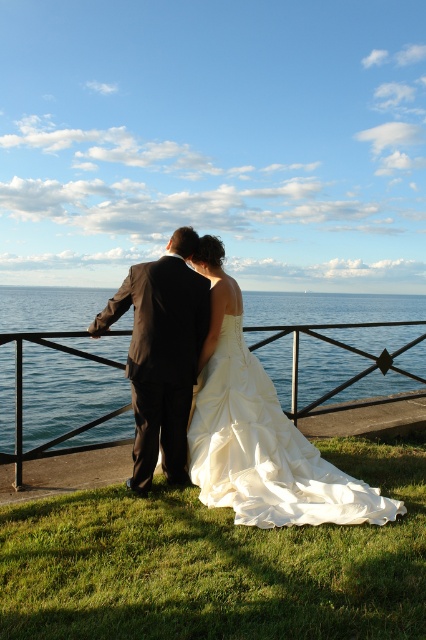
Consider the image. You are a photographer trying to capture the perfect shot of the matte white gown at center. The coordinates provided are in a normalized format where the top left corner of the image is point 0,0 and the bottom right is 1,1. If you want to focus on the gown, which direction should you move your camera relative to the current position?

The coordinates for the matte white gown at center are at point (259, 432). Since the x coordinate is 0.675 which is closer to 1, the gown is positioned more to the right. The y coordinate is 0.608, which is closer to 1, meaning it is lower on the image. To focus on the gown, you should move the camera slightly to the right and down to center it.

You are a photographer trying to capture a photo of both points in the scene. You can only focus on one point at a time. If you focus on point (212,320), will the other point (147,488) be in focus?

Since point (212,320) is behind point (147,488), focusing on the closer point (147,488) would keep both in focus. However, focusing on the farther point (212,320) may leave the closer point out of focus depending on depth of field. But according to the description, the two points are in a linear depth relation where one is behind the other. Therefore, focusing on the closer point (147,488) would ensure both are within acceptable focus range, but focusing on the farther point might not include